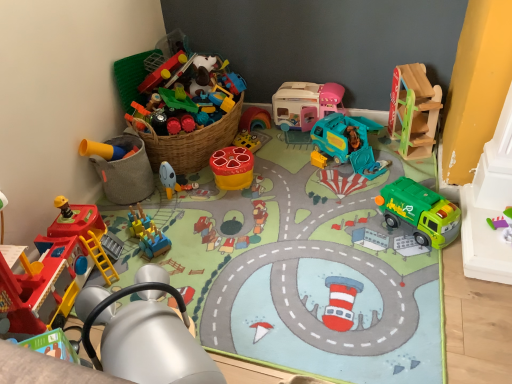
In order to click on free space in front of teal plastic garbage truck at center, acting as the 7th toy starting from the left in this screenshot , I will do `click(341, 188)`.